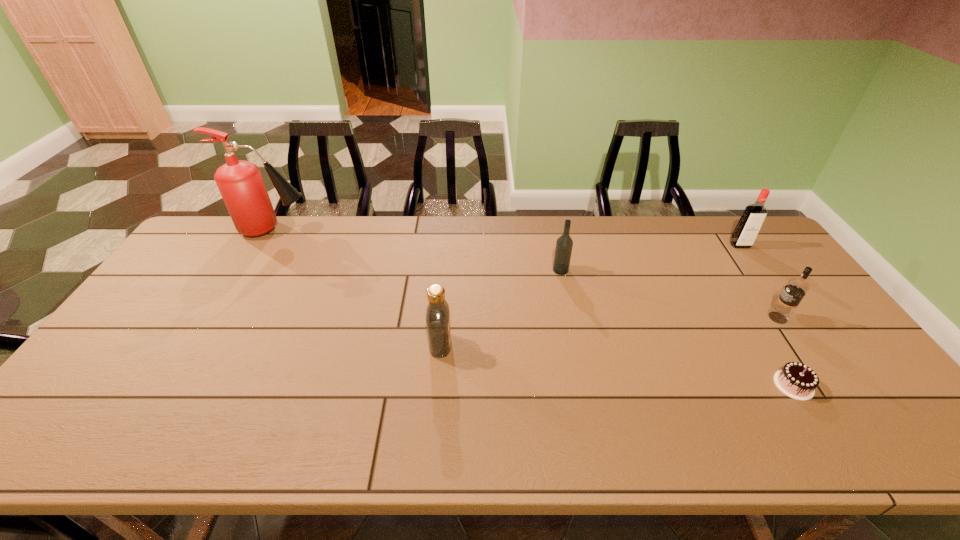
At what (x,y) coordinates should I click in order to perform the action: click on free point between the chocolate cake and the tallest object. Please return your answer as a coordinate pair (x, y). This screenshot has height=540, width=960. Looking at the image, I should click on (534, 307).

Identify the location of free area in between the chocolate cake and the tallest object. (534, 307).

Where is `free space between the third vodka from right to left and the farthest vodka`? free space between the third vodka from right to left and the farthest vodka is located at coordinates (650, 258).

Find the location of `vacant region between the farthest vodka and the farthest object`. vacant region between the farthest vodka and the farthest object is located at coordinates click(507, 237).

I want to click on free space between the fire extinguisher and the second nearest vodka, so pos(526,273).

I want to click on free space between the chocolate cake and the fourth farthest object, so click(786, 351).

Where is `vacant space in between the second farthest object and the fourth object from right to left`? This screenshot has width=960, height=540. vacant space in between the second farthest object and the fourth object from right to left is located at coordinates (650, 258).

This screenshot has height=540, width=960. Find the location of `free space between the fifth object from right to left and the third nearest vodka`. free space between the fifth object from right to left and the third nearest vodka is located at coordinates (500, 307).

The image size is (960, 540). I want to click on vacant space that is in between the second farthest object and the fourth nearest object, so click(650, 258).

Identify which object is the nearest to the tallest object. Please provide its 2D coordinates. Your answer should be formatted as a tuple, i.e. [(x, y)], where the tuple contains the x and y coordinates of a point satisfying the conditions above.

[(438, 324)]